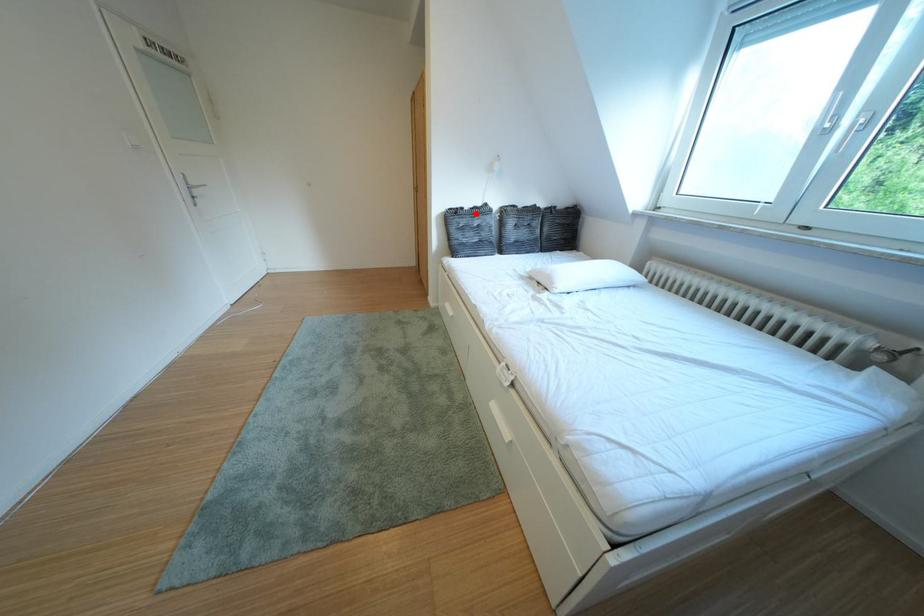
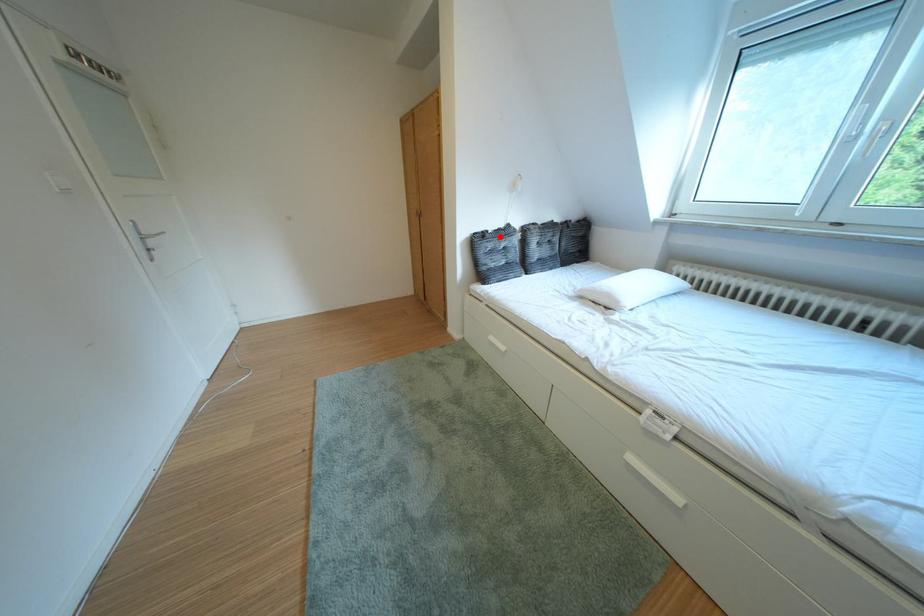
I am providing you with two images of the same scene from different viewpoints. A red point is marked on the first image and another point is marked on the second image. Does the point marked in image1 correspond to the same location as the one in image2?

Yes